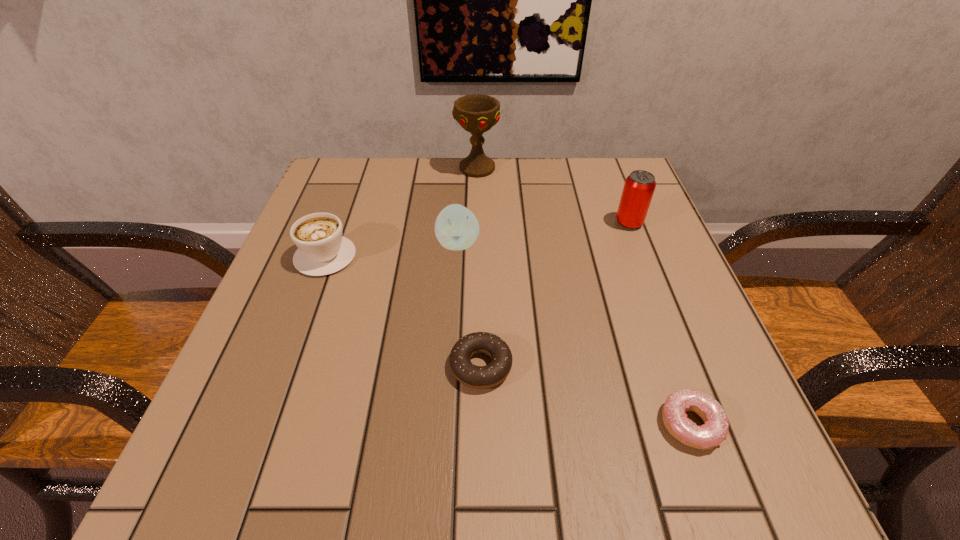
This screenshot has width=960, height=540. I want to click on vacant space located on the left of the chalice, so click(340, 168).

The width and height of the screenshot is (960, 540). Identify the location of free point located on the back of the fifth shortest object. (621, 201).

Where is `vacant space located 0.300m on the front of the apple`? vacant space located 0.300m on the front of the apple is located at coordinates coord(450,390).

Locate an element on the screen. vacant space situated 0.180m to the right of the cappuccino's handle is located at coordinates (350, 187).

Find the location of a particular element. Image resolution: width=960 pixels, height=540 pixels. vacant space located to the right of the cappuccino's handle is located at coordinates (346, 202).

You are a GUI agent. You are given a task and a screenshot of the screen. Output one action in this format:
    pyautogui.click(x=<x>, y=<y>)
    Task: Click on the free location located 0.130m to the right of the cappuccino's handle
    The image size is (960, 540).
    Given the screenshot: What is the action you would take?
    pyautogui.click(x=347, y=200)

This screenshot has height=540, width=960. Find the location of `vacant region located on the right of the fifth farthest object`. vacant region located on the right of the fifth farthest object is located at coordinates (713, 366).

Where is `free space located 0.340m on the left of the nearest object`? The width and height of the screenshot is (960, 540). free space located 0.340m on the left of the nearest object is located at coordinates (422, 424).

Find the location of a particular element. chalice that is positioned at the far edge is located at coordinates (476, 113).

Identify the location of can located in the far edge section of the desktop. (639, 187).